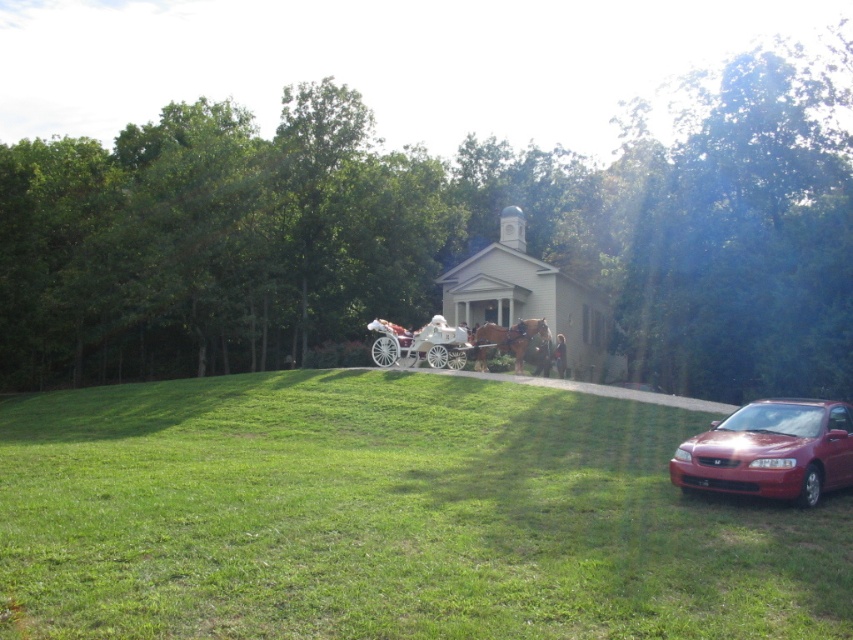
You are standing at the point marked by the coordinates point (389,516). Describe what you see around you based on the scene description.

The point (389,516) marks green grassy at lower left, so you are standing on green grassy area at the lower left of the scene.

You are planning to move the white glossy wagon at center to the lower left area where the green grassy at lower left is located. Considering the space available, will the wagon fit into that area without overlapping the grass?

The green grassy at lower left is wider than the white glossy wagon at center, so the wagon will fit into the area without overlapping the grass.